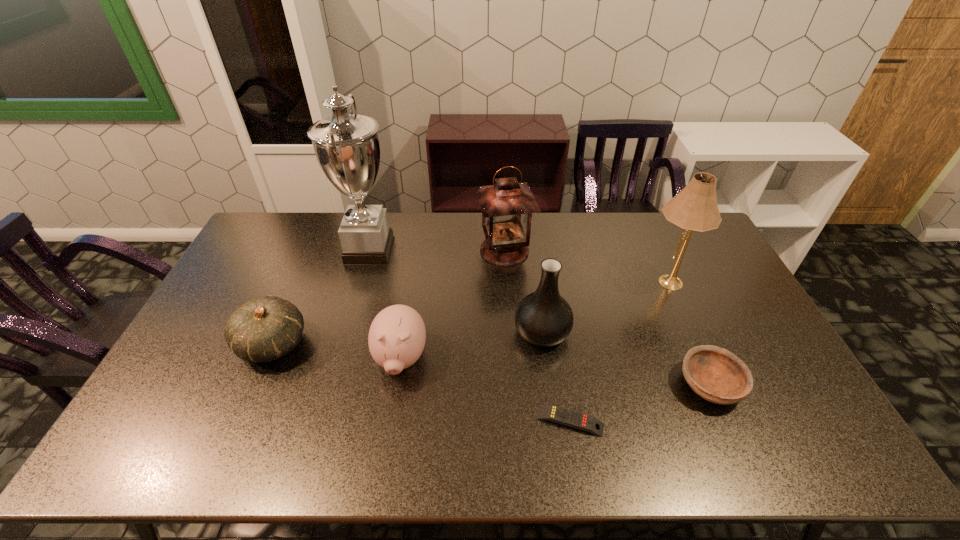
Find the location of `free point located 0.060m on the back of the sixth shortest object`. free point located 0.060m on the back of the sixth shortest object is located at coordinates (503, 224).

Identify the location of vacant space positioned on the right of the fifth shortest object. (647, 332).

I want to click on vacant space located 0.130m at the snout of the piggy bank, so click(x=389, y=435).

At what (x,y) coordinates should I click in order to perform the action: click on vacant space located on the right of the gourd. Please return your answer as a coordinate pair (x, y). This screenshot has width=960, height=540. Looking at the image, I should click on (387, 345).

This screenshot has width=960, height=540. Find the location of `blank space located 0.180m on the back of the seventh tallest object`. blank space located 0.180m on the back of the seventh tallest object is located at coordinates (677, 313).

The image size is (960, 540). I want to click on vacant space located 0.050m on the right of the shortest object, so click(624, 421).

This screenshot has width=960, height=540. Find the location of `trophy cup that is positioned at the far edge`. trophy cup that is positioned at the far edge is located at coordinates (347, 148).

This screenshot has height=540, width=960. Identify the location of oil lamp present at the far edge. (507, 206).

In order to click on object that is at the near edge in this screenshot , I will do `click(552, 413)`.

Identify the location of object present at the left edge. This screenshot has height=540, width=960. (263, 329).